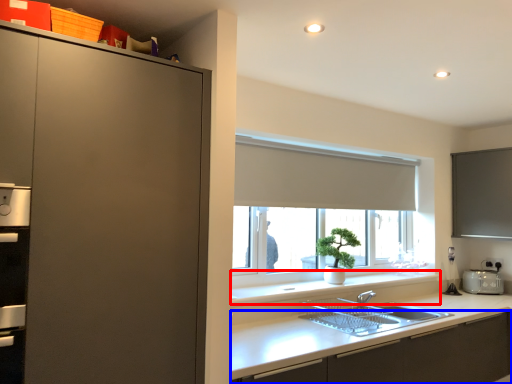
Question: Which point is closer to the camera, window sill (highlighted by a red box) or cabinetry (highlighted by a blue box)?

Choices:
 (A) window sill
 (B) cabinetry

Answer: (B)